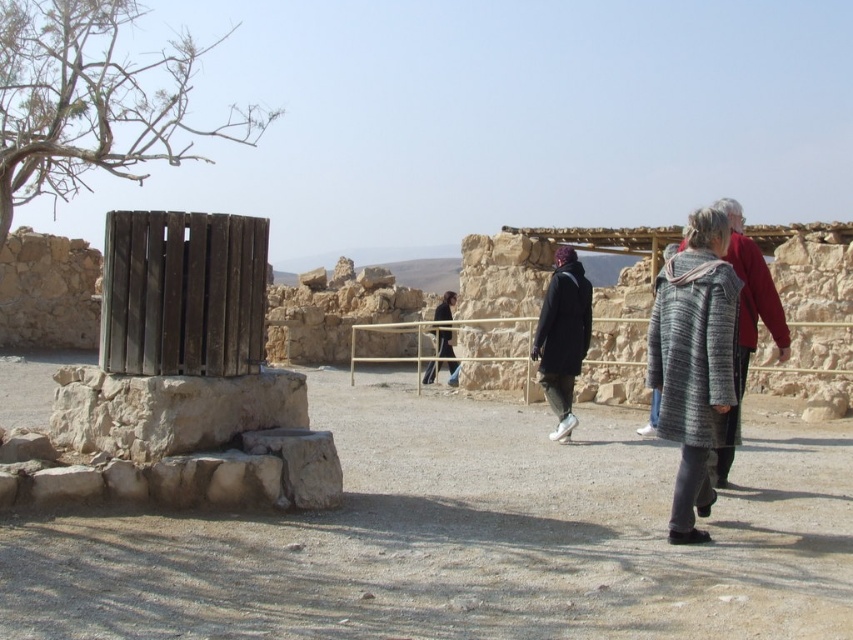
Between dirt field at center and gray wool coat at center right, which one has more height?

With more height is gray wool coat at center right.

Is dirt field at center to the right of gray wool coat at center right from the viewer's perspective?

Incorrect, dirt field at center is not on the right side of gray wool coat at center right.

Where is `dirt field at center`? Image resolution: width=853 pixels, height=640 pixels. dirt field at center is located at coordinates pos(466,538).

Who is taller, dirt field at center or dark brown leather jacket at center?

With more height is dark brown leather jacket at center.

Is the position of dirt field at center more distant than that of dark brown leather jacket at center?

No, it is in front of dark brown leather jacket at center.

Is point (782, 445) closer to camera compared to point (439, 356)?

That is True.

This screenshot has width=853, height=640. What are the coordinates of `dirt field at center` in the screenshot? It's located at (466, 538).

Can you confirm if gray wool coat at center right is smaller than natural stone wall at lower left?

Incorrect, gray wool coat at center right is not smaller in size than natural stone wall at lower left.

Between point (686, 444) and point (53, 424), which one is positioned behind?

Point (53, 424)

Between point (730, 349) and point (200, 378), which one is positioned behind?

The point (200, 378) is behind.

This screenshot has height=640, width=853. I want to click on gray wool coat at center right, so click(x=701, y=353).